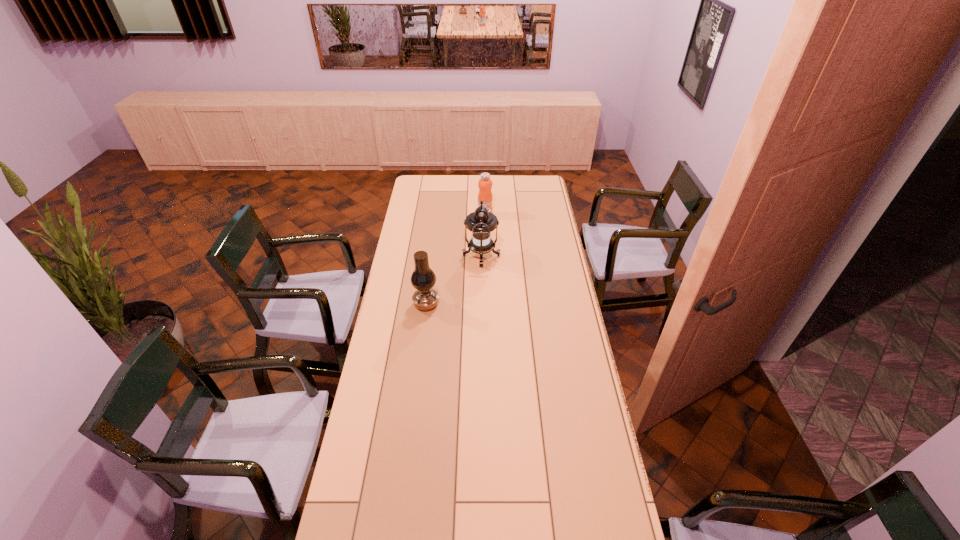
Find the location of a particular element. Image resolution: width=960 pixels, height=540 pixels. lantern is located at coordinates (481, 223).

What are the coordinates of `oil lamp` in the screenshot? It's located at (423, 278).

Locate an element on the screen. the leftmost object is located at coordinates (423, 278).

I want to click on the farthest object, so click(x=485, y=183).

This screenshot has height=540, width=960. Identify the location of free space located 0.270m on the right of the second nearest object. (555, 256).

This screenshot has width=960, height=540. I want to click on free space located on the right of the nearest object, so click(460, 304).

Where is `free space located on the left of the fruit juice`? The image size is (960, 540). free space located on the left of the fruit juice is located at coordinates (422, 215).

The height and width of the screenshot is (540, 960). What are the coordinates of `object that is at the left edge` in the screenshot? It's located at (423, 278).

Identify the location of free space at the far edge of the desktop. The width and height of the screenshot is (960, 540). (515, 185).

Find the location of a particular element. This screenshot has width=960, height=540. free location at the left edge is located at coordinates 407,404.